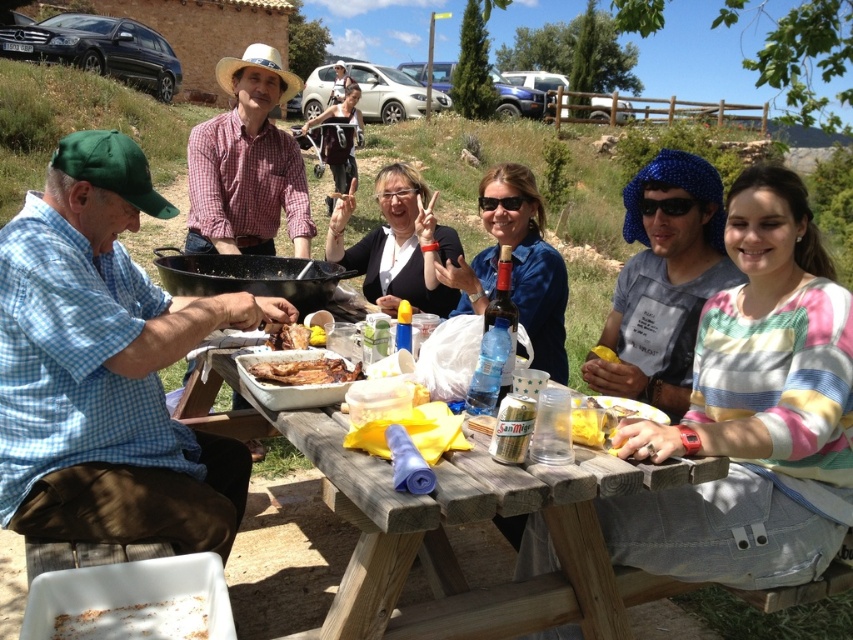
You are a photographer trying to capture the blue checkered shirt at left and the blue fabric headscarf at center in a single shot. Since you want both items to be clearly visible, will adjusting your camera angle upwards help ensure both are in frame?

The blue checkered shirt at left is positioned under the blue fabric headscarf at center. By angling the camera upwards, you can capture both items in the frame as the shirt is below the headscarf, so tilting up would include both.

Based on the coordinates provided, which object corresponds to the point at (106, 368)?

The blue checkered shirt at left corresponds to the point at (106, 368).